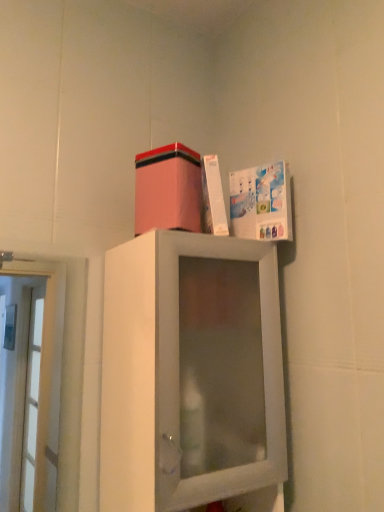
What is the approximate width of white matte cabinet at upper center?

white matte cabinet at upper center is 12.58 inches wide.

What do you see at coordinates (168, 189) in the screenshot?
I see `pink matte cardboard box at upper center` at bounding box center [168, 189].

Find the location of a particular element. This screenshot has height=512, width=384. pink matte cardboard box at upper center is located at coordinates (168, 189).

The width and height of the screenshot is (384, 512). In order to click on white matte cabinet at upper center in this screenshot , I will do `click(190, 372)`.

Is white matte cabinet at upper center facing towards white glossy book at upper right?

No, white matte cabinet at upper center is not aimed at white glossy book at upper right.

From the image's perspective, would you say white matte cabinet at upper center is positioned over white glossy book at upper right?

Actually, white matte cabinet at upper center appears below white glossy book at upper right in the image.

Considering the sizes of white matte cabinet at upper center and white glossy book at upper right in the image, is white matte cabinet at upper center taller or shorter than white glossy book at upper right?

white matte cabinet at upper center is taller than white glossy book at upper right.

From a real-world perspective, relative to white glossy book at upper right, is white matte cabinet at upper center vertically above or below?

Clearly, from a real-world perspective, white matte cabinet at upper center is below white glossy book at upper right.

Locate an element on the screen. The image size is (384, 512). book cover on the right side of pink matte cardboard box at upper center is located at coordinates (261, 202).

Considering the sizes of pink matte cardboard box at upper center and white glossy book at upper right in the image, is pink matte cardboard box at upper center bigger or smaller than white glossy book at upper right?

In the image, pink matte cardboard box at upper center appears to be larger than white glossy book at upper right.

Is pink matte cardboard box at upper center not inside white glossy book at upper right?

→ Yes, pink matte cardboard box at upper center is not within white glossy book at upper right.

From a real-world perspective, is pink matte cardboard box at upper center positioned under white glossy book at upper right based on gravity?

No, from a real-world perspective, pink matte cardboard box at upper center is not under white glossy book at upper right.

From a real-world perspective, is white glossy book at upper right located higher than pink matte cardboard box at upper center?

Incorrect, from a real-world perspective, white glossy book at upper right is lower than pink matte cardboard box at upper center.

Does white glossy book at upper right turn towards pink matte cardboard box at upper center?

No, white glossy book at upper right is not facing towards pink matte cardboard box at upper center.

Based on the photo, which is less distant, (x=231, y=183) or (x=152, y=196)?

The point (x=152, y=196) is in front.

Choose the correct answer: Is white matte cabinet at upper center inside pink matte cardboard box at upper center or outside it?

white matte cabinet at upper center is located beyond the bounds of pink matte cardboard box at upper center.

Based on their sizes in the image, would you say white matte cabinet at upper center is bigger or smaller than pink matte cardboard box at upper center?

white matte cabinet at upper center is bigger than pink matte cardboard box at upper center.

Is white matte cabinet at upper center touching pink matte cardboard box at upper center?

white matte cabinet at upper center and pink matte cardboard box at upper center are clearly separated.

From a real-world perspective, between white matte cabinet at upper center and pink matte cardboard box at upper center, who is vertically higher?

pink matte cardboard box at upper center is physically above.

Is white glossy book at upper right surrounding white matte cabinet at upper center?

Definitely not — white matte cabinet at upper center is not inside white glossy book at upper right.

Is white glossy book at upper right looking in the opposite direction of white matte cabinet at upper center?

No, white glossy book at upper right's orientation is not away from white matte cabinet at upper center.

Can you confirm if white glossy book at upper right is bigger than white matte cabinet at upper center?

Actually, white glossy book at upper right might be smaller than white matte cabinet at upper center.

Does point (177, 170) come behind point (152, 270)?

Yes, point (177, 170) is farther from viewer.

Considering the relative sizes of pink matte cardboard box at upper center and white matte cabinet at upper center in the image provided, is pink matte cardboard box at upper center wider than white matte cabinet at upper center?

In fact, pink matte cardboard box at upper center might be narrower than white matte cabinet at upper center.

How distant is pink matte cardboard box at upper center from white matte cabinet at upper center?

pink matte cardboard box at upper center and white matte cabinet at upper center are 10.38 inches apart.

Is pink matte cardboard box at upper center placed right next to white matte cabinet at upper center?

They are not placed beside each other.

Where is `book cover above the white matte cabinet at upper center (from the image's perspective)`? book cover above the white matte cabinet at upper center (from the image's perspective) is located at coordinates (261, 202).

The height and width of the screenshot is (512, 384). Find the location of `cardboard box to the left of white glossy book at upper right`. cardboard box to the left of white glossy book at upper right is located at coordinates (168, 189).

From the image, which object appears to be nearer to white matte cabinet at upper center, pink matte cardboard box at upper center or white glossy book at upper right?

Based on the image, pink matte cardboard box at upper center appears to be nearer to white matte cabinet at upper center.

Consider the image. Estimate the real-world distances between objects in this image. Which object is further from white glossy book at upper right, white matte cabinet at upper center or pink matte cardboard box at upper center?

Based on the image, white matte cabinet at upper center appears to be further to white glossy book at upper right.

Looking at the image, which one is located further to pink matte cardboard box at upper center, white matte cabinet at upper center or white glossy book at upper right?

Based on the image, white matte cabinet at upper center appears to be further to pink matte cardboard box at upper center.

Estimate the real-world distances between objects in this image. Which object is further from white matte cabinet at upper center, white glossy book at upper right or pink matte cardboard box at upper center?

The object further to white matte cabinet at upper center is white glossy book at upper right.

Considering their positions, is pink matte cardboard box at upper center positioned closer to white glossy book at upper right than white matte cabinet at upper center?

pink matte cardboard box at upper center is closer to white glossy book at upper right.

Estimate the real-world distances between objects in this image. Which object is closer to pink matte cardboard box at upper center, white glossy book at upper right or white matte cabinet at upper center?

white glossy book at upper right is closer to pink matte cardboard box at upper center.

The height and width of the screenshot is (512, 384). Identify the location of book cover that lies between pink matte cardboard box at upper center and white matte cabinet at upper center from top to bottom. (261, 202).